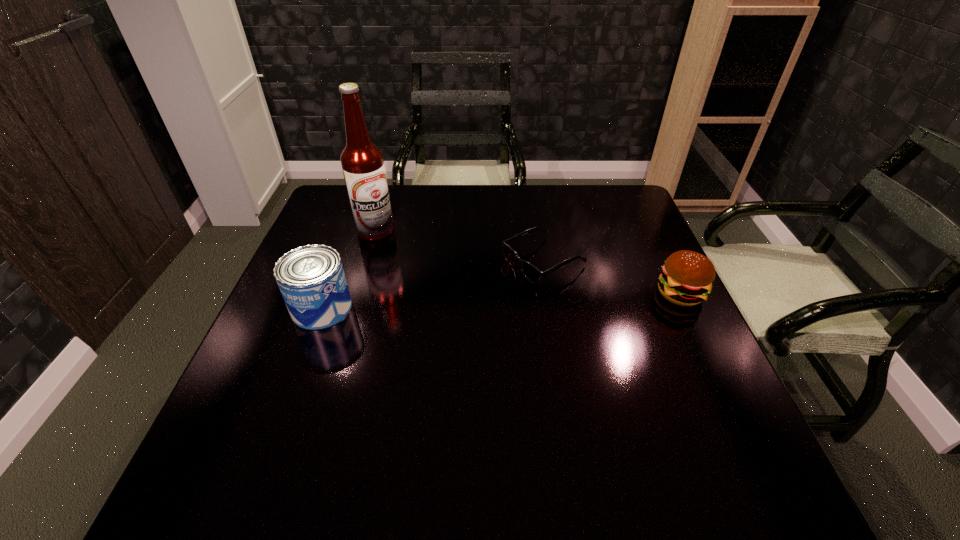
At what (x,y) coordinates should I click in order to perform the action: click on unoccupied area between the tallest object and the can. Please return your answer as a coordinate pair (x, y). The image size is (960, 540). Looking at the image, I should click on (348, 269).

This screenshot has height=540, width=960. I want to click on empty space that is in between the alcohol and the sunglasses, so click(460, 246).

Identify the location of free area in between the second tallest object and the third object from left to right. The width and height of the screenshot is (960, 540). (433, 285).

Locate an element on the screen. This screenshot has height=540, width=960. empty space that is in between the rightmost object and the tallest object is located at coordinates (528, 262).

Locate an element on the screen. vacant space that's between the shortest object and the can is located at coordinates (433, 285).

Identify the location of free space between the alcohol and the rightmost object. The image size is (960, 540). (528, 262).

This screenshot has height=540, width=960. I want to click on object identified as the third closest to the third object from left to right, so [311, 278].

This screenshot has height=540, width=960. Find the location of `the closest object to the can`. the closest object to the can is located at coordinates (362, 162).